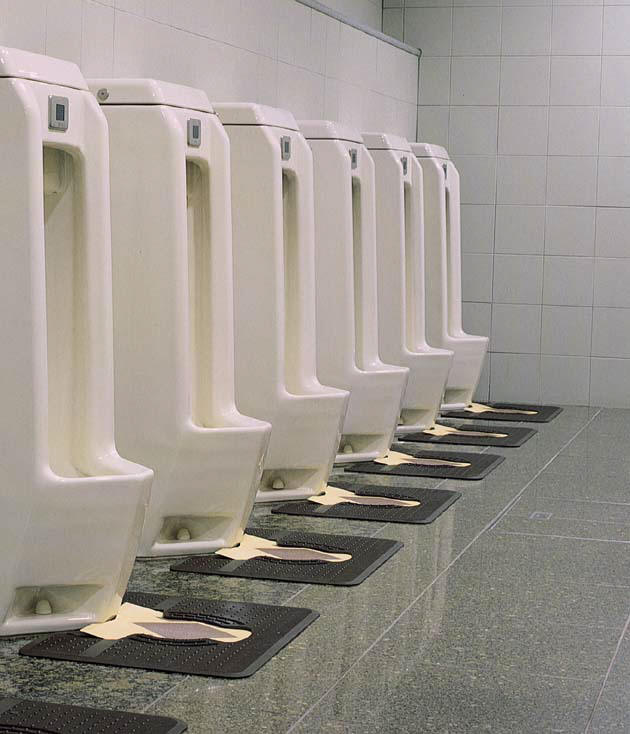
This screenshot has height=734, width=630. Identify the location of urinals. (79, 329), (188, 269), (272, 280), (339, 277), (421, 266), (447, 244).